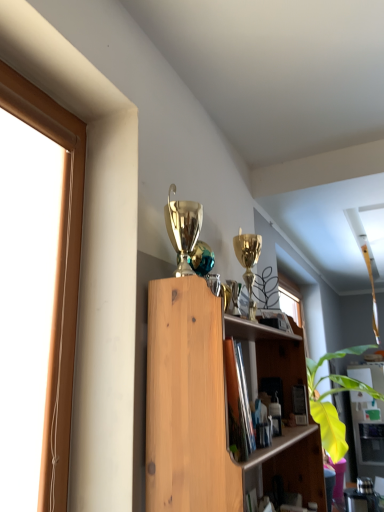
Question: From a real-world perspective, does matte wood cabinet at center sit lower than wooden shelf at center?

Choices:
 (A) yes
 (B) no

Answer: (A)

Question: Does matte wood cabinet at center appear on the right side of wooden shelf at center?

Choices:
 (A) no
 (B) yes

Answer: (B)

Question: Is the surface of matte wood cabinet at center in direct contact with wooden shelf at center?

Choices:
 (A) no
 (B) yes

Answer: (A)

Question: Considering the relative sizes of matte wood cabinet at center and wooden shelf at center in the image provided, is matte wood cabinet at center bigger than wooden shelf at center?

Choices:
 (A) no
 (B) yes

Answer: (B)

Question: From the image's perspective, is matte wood cabinet at center above wooden shelf at center?

Choices:
 (A) no
 (B) yes

Answer: (A)

Question: Is matte wood cabinet at center not near wooden shelf at center?

Choices:
 (A) no
 (B) yes

Answer: (B)

Question: Does wooden shelf at center lie in front of matte wood cabinet at center?

Choices:
 (A) yes
 (B) no

Answer: (A)

Question: Can you confirm if wooden shelf at center is shorter than matte wood cabinet at center?

Choices:
 (A) no
 (B) yes

Answer: (B)

Question: From a real-world perspective, is wooden shelf at center located higher than matte wood cabinet at center?

Choices:
 (A) no
 (B) yes

Answer: (B)

Question: Can you confirm if wooden shelf at center is wider than matte wood cabinet at center?

Choices:
 (A) yes
 (B) no

Answer: (B)

Question: Is wooden shelf at center in contact with matte wood cabinet at center?

Choices:
 (A) no
 (B) yes

Answer: (A)

Question: Is wooden shelf at center located outside matte wood cabinet at center?

Choices:
 (A) no
 (B) yes

Answer: (B)

Question: Is point (190, 507) positioned closer to the camera than point (357, 369)?

Choices:
 (A) closer
 (B) farther

Answer: (A)